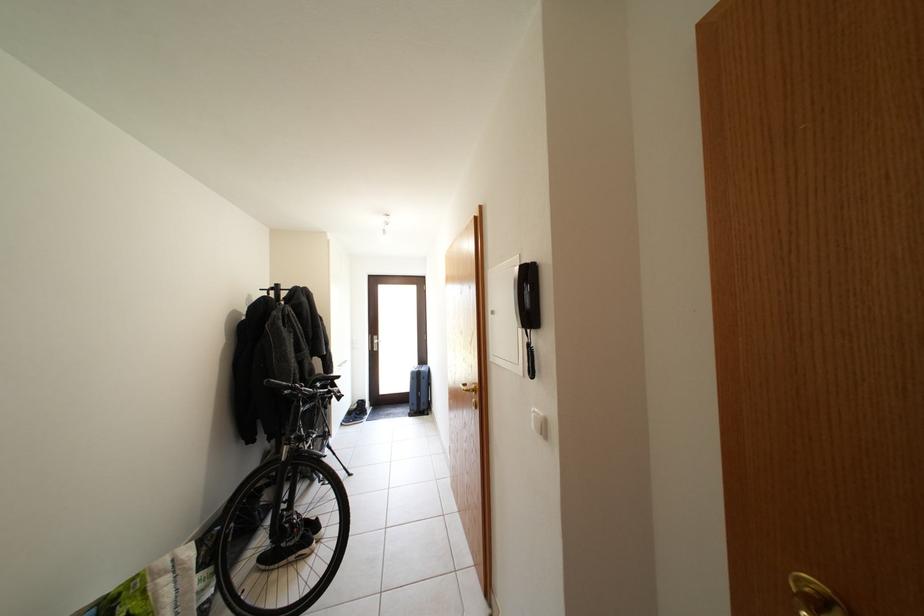
Locate an element on the screen. black telephone handset is located at coordinates (527, 296).